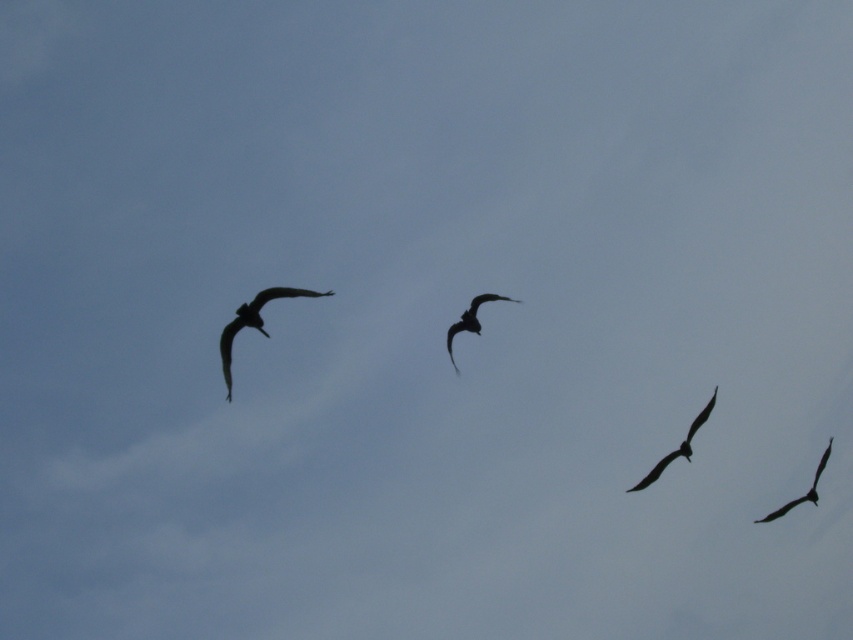
Can you confirm if black matte bird at upper left is positioned below silhouette feathered bird at lower right?

No.

What do you see at coordinates (253, 323) in the screenshot? Image resolution: width=853 pixels, height=640 pixels. I see `black matte bird at upper left` at bounding box center [253, 323].

The width and height of the screenshot is (853, 640). Find the location of `black matte bird at upper left`. black matte bird at upper left is located at coordinates (253, 323).

Is black matte bird at lower right smaller than silhouette feathered bird at center?

Yes.

Can you confirm if black matte bird at lower right is positioned below silhouette feathered bird at center?

Indeed, black matte bird at lower right is positioned under silhouette feathered bird at center.

Does point (704, 406) lie behind point (474, 316)?

Yes, it is behind point (474, 316).

In order to click on black matte bird at lower right in this screenshot , I will do `click(677, 445)`.

Does silhouette feathered bird at center appear on the right side of silhouette feathered bird at lower right?

In fact, silhouette feathered bird at center is to the left of silhouette feathered bird at lower right.

Between point (461, 330) and point (762, 520), which one is positioned behind?

Positioned behind is point (762, 520).

This screenshot has width=853, height=640. What are the coordinates of `silhouette feathered bird at center` in the screenshot? It's located at (469, 321).